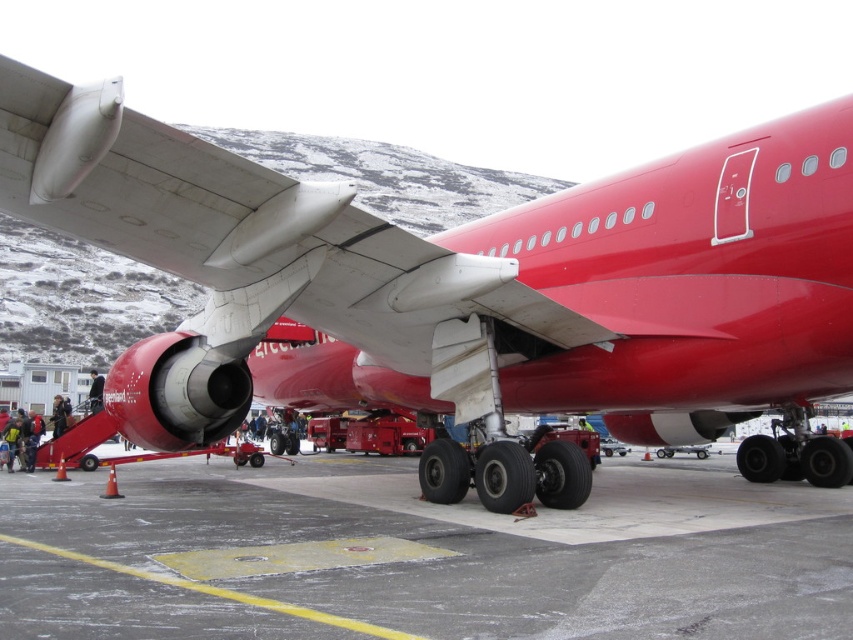
Between point (462, 289) and point (149, 529), which one is positioned in front?

Positioned in front is point (149, 529).

Is matte red airplane at center shorter than gray asphalt at lower center?

Yes.

Between point (723, 148) and point (527, 548), which one is positioned behind?

The point (723, 148) is more distant.

Where is `matte red airplane at center`? Image resolution: width=853 pixels, height=640 pixels. matte red airplane at center is located at coordinates (465, 292).